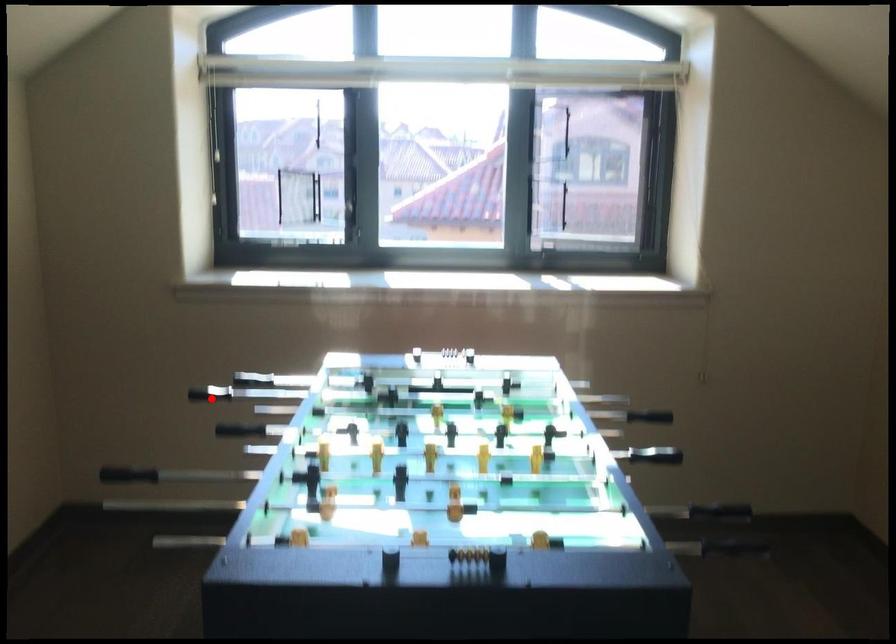
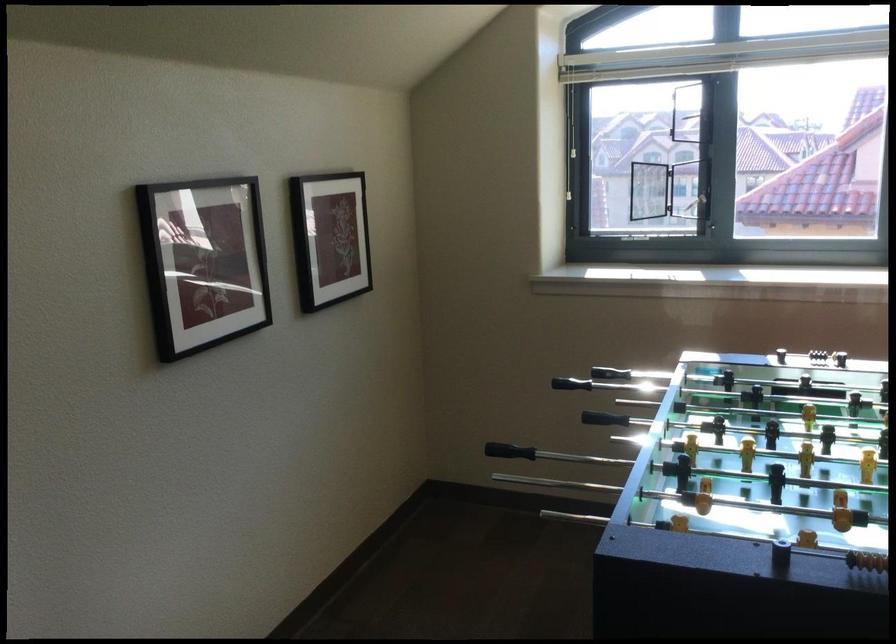
The point at the highlighted location is marked in the first image. Where is the corresponding point in the second image?

(570, 384)